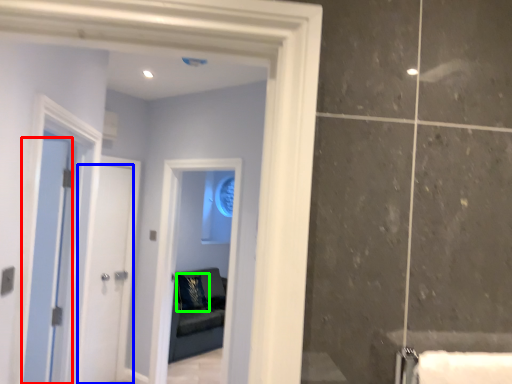
Question: Based on their relative distances, which object is nearer to door (highlighted by a red box)? Choose from door (highlighted by a blue box) and pillow (highlighted by a green box).

Choices:
 (A) door
 (B) pillow

Answer: (A)